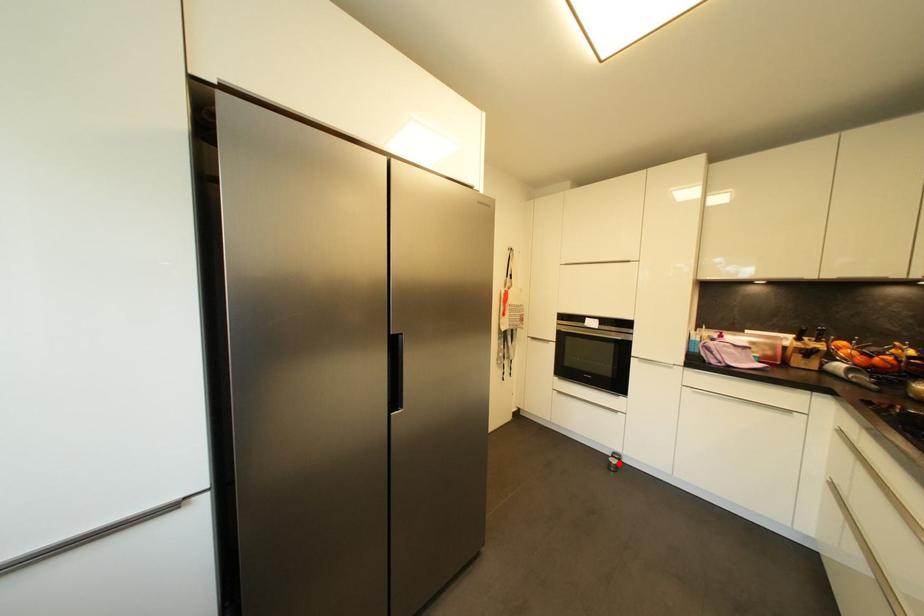
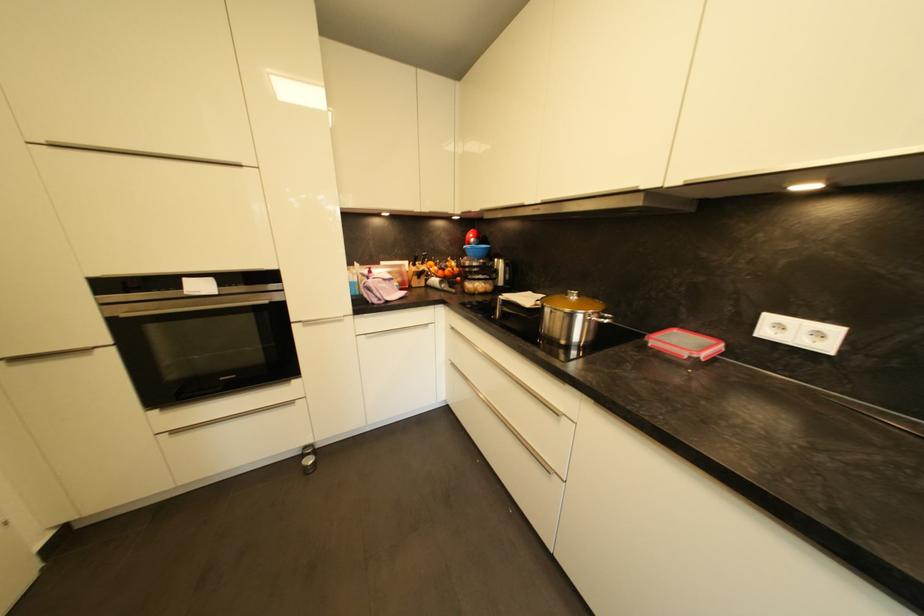
Question: I am providing you with two images of the same scene from different viewpoints. Given a red point in image1, look at the same physical point in image2. Is it:

Choices:
 (A) Closer to the viewpoint
 (B) Farther from the viewpoint

Answer: (B)